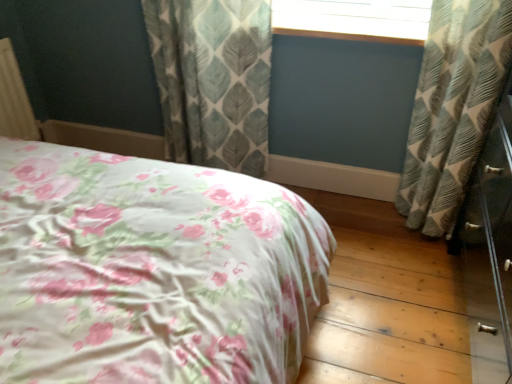
Question: From a real-world perspective, is textured gray-green curtain at right, arranged as the first curtain when viewed from the right, above or below floral fabric bed at center?

Choices:
 (A) above
 (B) below

Answer: (B)

Question: Visually, is textured gray-green curtain at right, arranged as the second curtain when viewed from the left, positioned to the left or to the right of floral fabric bed at center?

Choices:
 (A) right
 (B) left

Answer: (A)

Question: Estimate the real-world distances between objects in this image. Which object is farther from the textured gray-green curtain at right, arranged as the first curtain when viewed from the right?

Choices:
 (A) floral fabric bed at center
 (B) textured gray-green leaf-patterned curtain at center, which is the first curtain from left to right
 (C) wooden window frame at upper center

Answer: (A)

Question: Which object is positioned farthest from the textured gray-green curtain at right, arranged as the first curtain when viewed from the right?

Choices:
 (A) textured gray-green leaf-patterned curtain at center, positioned as the 2th curtain in right-to-left order
 (B) floral fabric bed at center
 (C) wooden window frame at upper center

Answer: (B)